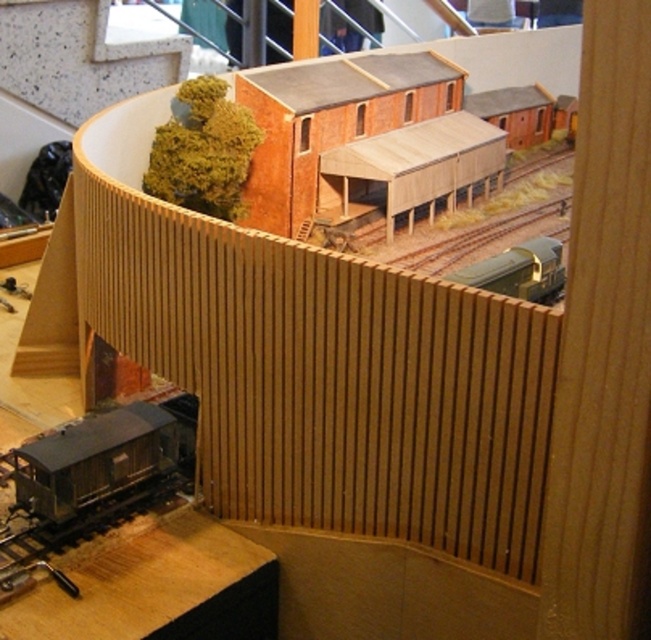
Question: Can you confirm if metallic gray train car at lower left is smaller than metallic gold train at center?

Choices:
 (A) no
 (B) yes

Answer: (A)

Question: Is metallic gray train car at lower left bigger than metallic gold train at center?

Choices:
 (A) no
 (B) yes

Answer: (B)

Question: Which object is closer to the camera taking this photo?

Choices:
 (A) metallic gray train car at lower left
 (B) metallic gold train at center

Answer: (A)

Question: Does metallic gray train car at lower left have a greater width compared to metallic gold train at center?

Choices:
 (A) yes
 (B) no

Answer: (A)

Question: Which object is closer to the camera taking this photo?

Choices:
 (A) metallic gray train car at lower left
 (B) metallic gold train at center

Answer: (A)